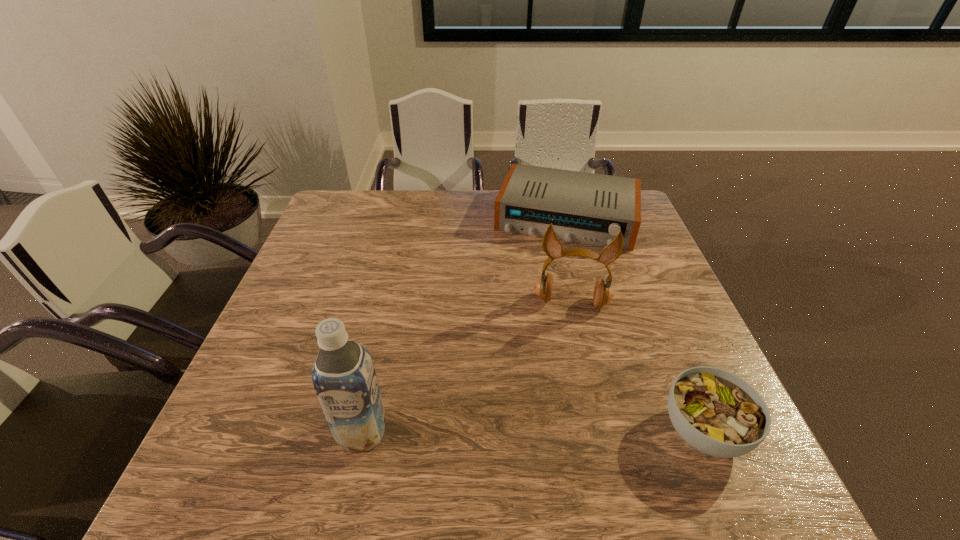
The height and width of the screenshot is (540, 960). What are the coordinates of `free space between the soya milk and the second farthest object` in the screenshot? It's located at (467, 367).

Locate an element on the screen. The width and height of the screenshot is (960, 540). empty space between the radio receiver and the leftmost object is located at coordinates (465, 325).

At what (x,y) coordinates should I click in order to perform the action: click on vacant region between the third shortest object and the leftmost object. Please return your answer as a coordinate pair (x, y). The image size is (960, 540). Looking at the image, I should click on (467, 367).

In order to click on vacant space that is in between the third nearest object and the soup bowl in this screenshot , I will do `click(637, 367)`.

Locate an element on the screen. This screenshot has width=960, height=540. unoccupied position between the earphone and the leftmost object is located at coordinates (467, 367).

Identify the location of object that is the third closest to the soya milk. (589, 208).

Choose which object is the second nearest neighbor to the earphone. Please provide its 2D coordinates. Your answer should be formatted as a tuple, i.e. [(x, y)], where the tuple contains the x and y coordinates of a point satisfying the conditions above.

[(716, 412)]